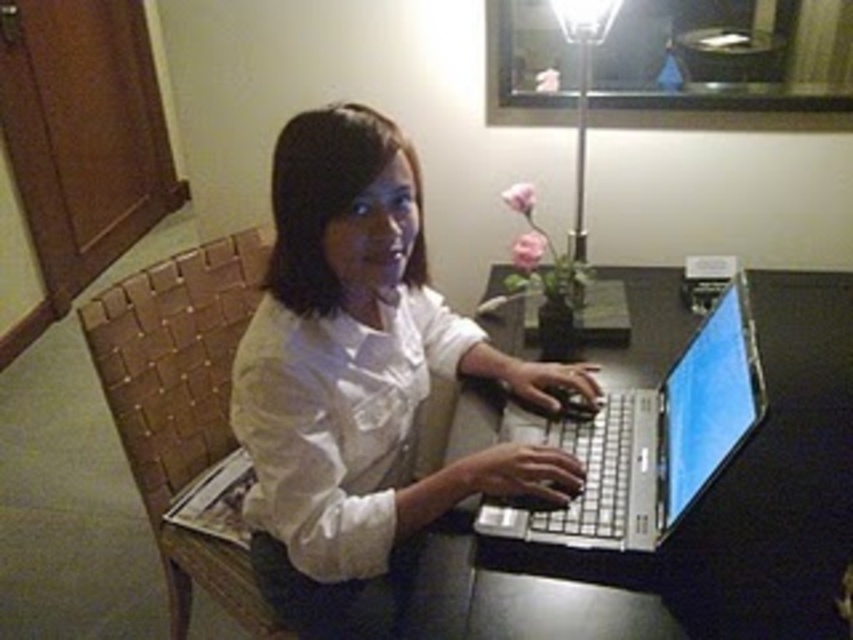
Question: Which point appears closest to the camera in this image?

Choices:
 (A) (581, 84)
 (B) (323, 518)

Answer: (B)

Question: Does white matte shirt at center appear under metallic silver lamp at upper center?

Choices:
 (A) yes
 (B) no

Answer: (A)

Question: Observing the image, what is the correct spatial positioning of white matte shirt at center in reference to metallic silver lamp at upper center?

Choices:
 (A) below
 (B) above

Answer: (A)

Question: Can you confirm if white matte shirt at center is positioned below silver metallic laptop at center?

Choices:
 (A) yes
 (B) no

Answer: (B)

Question: Which point appears closest to the camera in this image?

Choices:
 (A) (306, 550)
 (B) (554, 518)

Answer: (A)

Question: Which object is positioned closest to the metallic silver lamp at upper center?

Choices:
 (A) silver metallic laptop at center
 (B) white matte shirt at center

Answer: (A)